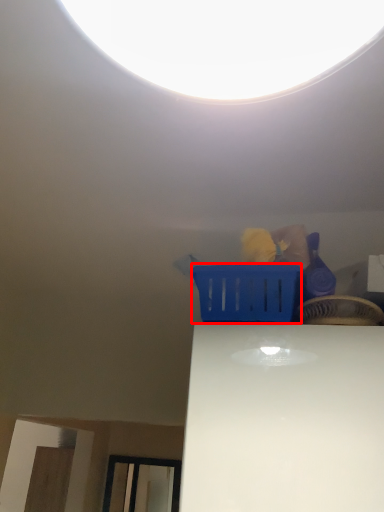
Question: Where is basket (annotated by the red box) located in relation to basket in the image?

Choices:
 (A) left
 (B) right

Answer: (A)